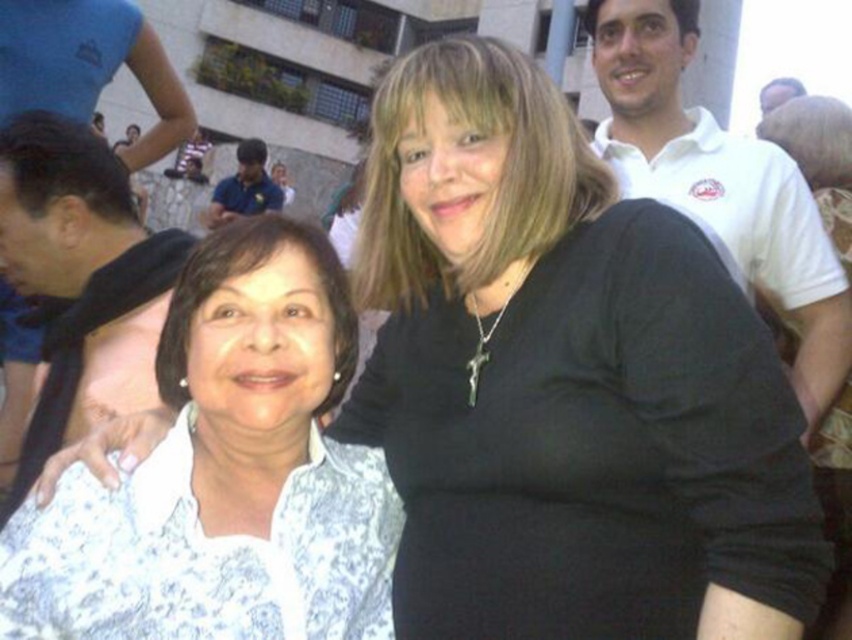
Question: Which point is closer to the camera taking this photo?

Choices:
 (A) (217, 220)
 (B) (809, 204)

Answer: (B)

Question: Is white lace blouse at center wider than black scarf at left?

Choices:
 (A) no
 (B) yes

Answer: (B)

Question: In this image, where is white lace blouse at center located relative to black scarf at left?

Choices:
 (A) right
 (B) left

Answer: (A)

Question: Can you confirm if black scarf at left is wider than blue shirt at center?

Choices:
 (A) no
 (B) yes

Answer: (A)

Question: Which object appears closest to the camera in this image?

Choices:
 (A) blue shirt at center
 (B) white cotton polo shirt at upper right
 (C) white lace blouse at center

Answer: (C)

Question: Among these objects, which one is farthest from the camera?

Choices:
 (A) white lace blouse at center
 (B) blue shirt at center

Answer: (B)